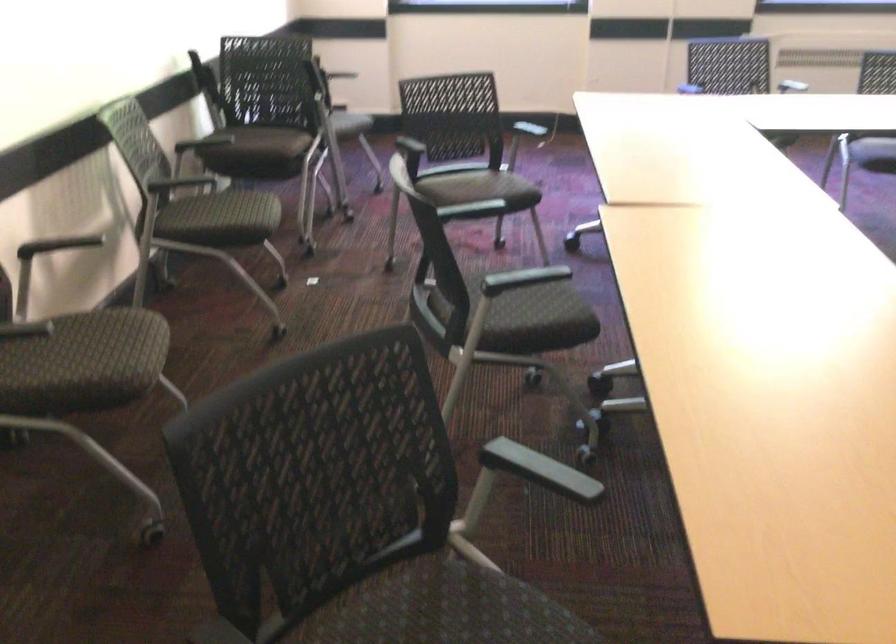
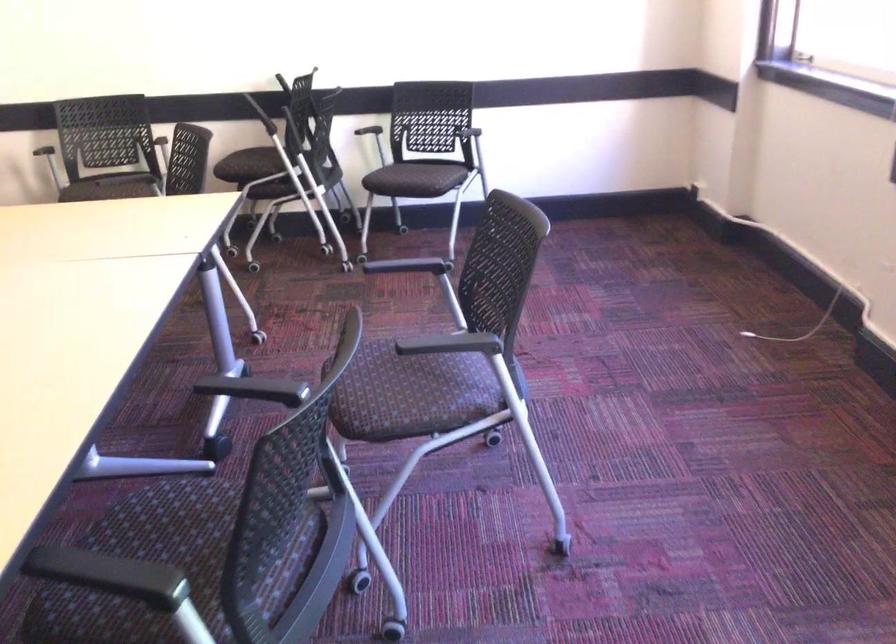
Find the pixel in the second image that matches point (302, 143) in the first image.

(252, 166)